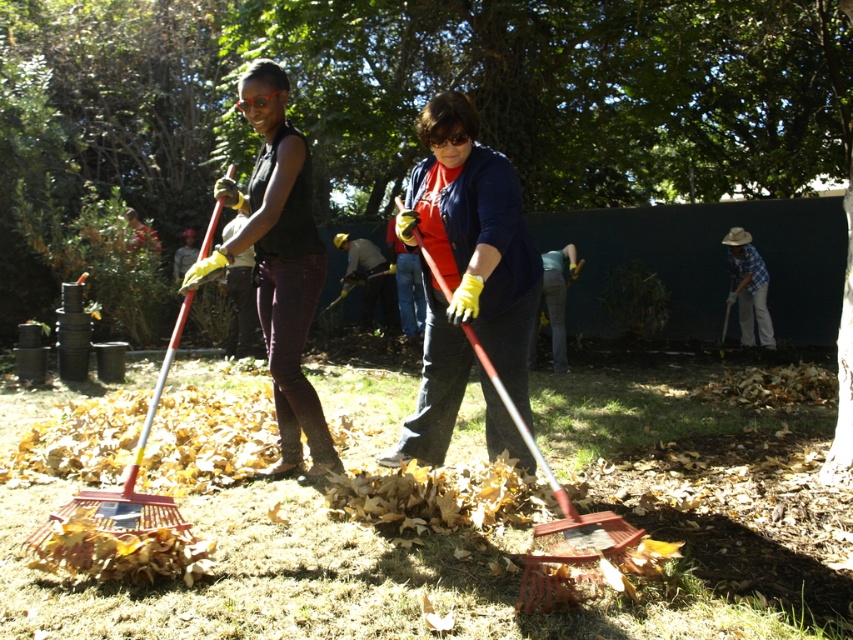
You are a photographer standing in front of the scene. You want to take a photo of the matte black shirt at center and the dark gray fabric shirt at center. Which one is closer to the camera?

The matte black shirt at center is positioned under dark gray fabric shirt at center, so the dark gray fabric shirt at center is closer to the camera.

You are a photographer trying to capture a photo of the two people in the scene. You want to ensure that both the matte black shirt at center and the dark gray fabric shirt at center are clearly visible in your shot. Given their heights, which shirt should you focus on to ensure proper focus and framing?

The matte black shirt at center is taller than the dark gray fabric shirt at center, so focusing on the matte black shirt at center would ensure proper focus and framing since it is the taller one and likely the main subject.